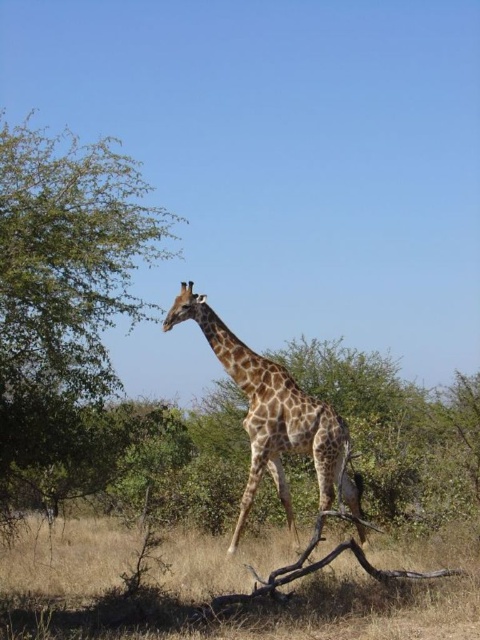
Question: Is green leafy tree at upper left bigger than dry grass at lower center?

Choices:
 (A) no
 (B) yes

Answer: (B)

Question: Which point is closer to the camera taking this photo?

Choices:
 (A) click(x=299, y=436)
 (B) click(x=333, y=627)

Answer: (B)

Question: Which of the following is the farthest from the observer?

Choices:
 (A) golden-brown spotted giraffe at center
 (B) dry grass at lower center
 (C) green leafy tree at upper left

Answer: (A)

Question: Is green leafy tree at upper left to the right of golden-brown spotted giraffe at center from the viewer's perspective?

Choices:
 (A) no
 (B) yes

Answer: (A)

Question: Which is nearer to the golden-brown spotted giraffe at center?

Choices:
 (A) green leafy tree at upper left
 (B) dry grass at lower center

Answer: (B)

Question: Does green leafy tree at upper left appear on the right side of dry grass at lower center?

Choices:
 (A) yes
 (B) no

Answer: (B)